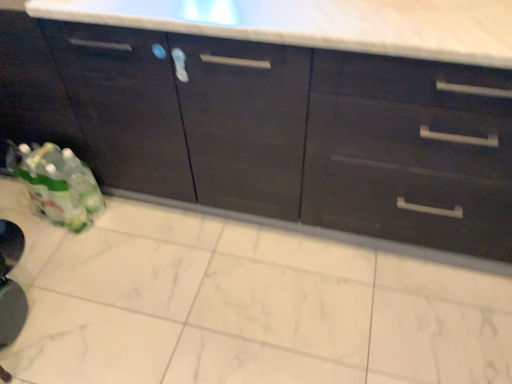
Question: Is the depth of matte black cabinet at lower left, which is the first cabinetry from left to right, greater than that of matte dark wood cabinets at center, acting as the first cabinetry starting from the right?

Choices:
 (A) no
 (B) yes

Answer: (B)

Question: Does matte black cabinet at lower left, which is the second cabinetry from right to left, have a greater width compared to matte dark wood cabinets at center, acting as the first cabinetry starting from the right?

Choices:
 (A) no
 (B) yes

Answer: (B)

Question: Is matte dark wood cabinets at center, acting as the first cabinetry starting from the right, at the back of matte black cabinet at lower left, which is the second cabinetry from right to left?

Choices:
 (A) no
 (B) yes

Answer: (A)

Question: Can you confirm if matte black cabinet at lower left, which is the first cabinetry from left to right, is positioned to the left of matte dark wood cabinets at center, acting as the first cabinetry starting from the right?

Choices:
 (A) yes
 (B) no

Answer: (A)

Question: Considering the relative sizes of matte black cabinet at lower left, which is the second cabinetry from right to left, and matte dark wood cabinets at center, positioned as the second cabinetry in left-to-right order, in the image provided, is matte black cabinet at lower left, which is the second cabinetry from right to left, taller than matte dark wood cabinets at center, positioned as the second cabinetry in left-to-right order,?

Choices:
 (A) yes
 (B) no

Answer: (B)

Question: Can you confirm if matte black cabinet at lower left, which is the first cabinetry from left to right, is positioned to the right of matte dark wood cabinets at center, acting as the first cabinetry starting from the right?

Choices:
 (A) no
 (B) yes

Answer: (A)

Question: Considering the relative sizes of matte dark wood cabinets at center, positioned as the second cabinetry in left-to-right order, and matte black cabinet at lower left, which is the second cabinetry from right to left, in the image provided, is matte dark wood cabinets at center, positioned as the second cabinetry in left-to-right order, shorter than matte black cabinet at lower left, which is the second cabinetry from right to left,?

Choices:
 (A) no
 (B) yes

Answer: (A)

Question: Is matte dark wood cabinets at center, positioned as the second cabinetry in left-to-right order, closer to the viewer compared to matte black cabinet at lower left, which is the second cabinetry from right to left?

Choices:
 (A) yes
 (B) no

Answer: (A)

Question: From a real-world perspective, is matte dark wood cabinets at center, acting as the first cabinetry starting from the right, physically below matte black cabinet at lower left, which is the first cabinetry from left to right?

Choices:
 (A) no
 (B) yes

Answer: (B)

Question: From the image's perspective, is matte dark wood cabinets at center, positioned as the second cabinetry in left-to-right order, on matte black cabinet at lower left, which is the second cabinetry from right to left?

Choices:
 (A) yes
 (B) no

Answer: (B)

Question: Could you tell me if matte dark wood cabinets at center, positioned as the second cabinetry in left-to-right order, is facing matte black cabinet at lower left, which is the first cabinetry from left to right?

Choices:
 (A) yes
 (B) no

Answer: (B)

Question: Is matte dark wood cabinets at center, acting as the first cabinetry starting from the right, not inside matte black cabinet at lower left, which is the first cabinetry from left to right?

Choices:
 (A) no
 (B) yes

Answer: (B)

Question: Looking at their shapes, would you say matte black cabinet at lower left, which is the second cabinetry from right to left, is wider or thinner than matte dark wood cabinets at center, positioned as the second cabinetry in left-to-right order?

Choices:
 (A) thin
 (B) wide

Answer: (B)